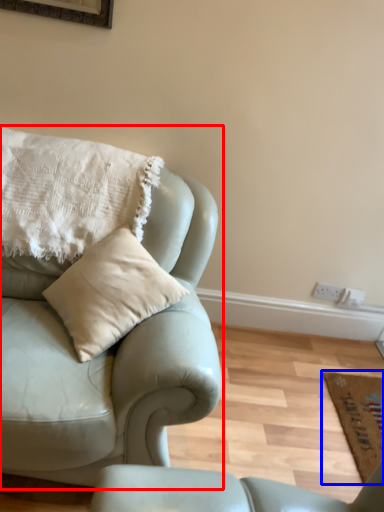
Question: Which object appears closest to the camera in this image, studio couch (highlighted by a red box) or mat (highlighted by a blue box)?

Choices:
 (A) studio couch
 (B) mat

Answer: (A)